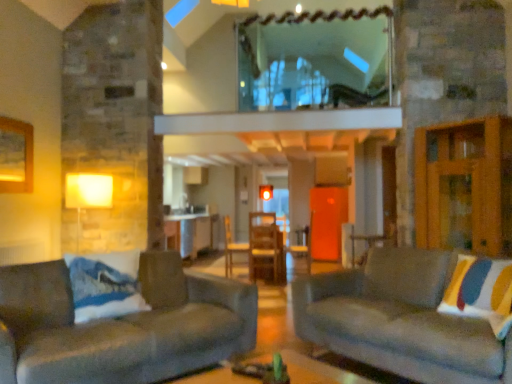
Question: Does velvet gray couch at left, acting as the 2th studio couch starting from the right, turn towards velvet gray couch at right, the 1th studio couch viewed from the right?

Choices:
 (A) no
 (B) yes

Answer: (A)

Question: Is velvet gray couch at right, the 1th studio couch viewed from the right, a part of velvet gray couch at left, positioned as the first studio couch in left-to-right order?

Choices:
 (A) yes
 (B) no

Answer: (B)

Question: Considering the relative positions of velvet gray couch at left, acting as the 2th studio couch starting from the right, and velvet gray couch at right, the 1th studio couch viewed from the right, in the image provided, is velvet gray couch at left, acting as the 2th studio couch starting from the right, to the left of velvet gray couch at right, the 1th studio couch viewed from the right, from the viewer's perspective?

Choices:
 (A) no
 (B) yes

Answer: (B)

Question: Can you confirm if velvet gray couch at left, positioned as the first studio couch in left-to-right order, is taller than velvet gray couch at right, the 1th studio couch viewed from the right?

Choices:
 (A) no
 (B) yes

Answer: (A)

Question: Is velvet gray couch at left, acting as the 2th studio couch starting from the right, completely or partially outside of velvet gray couch at right, the 1th studio couch viewed from the right?

Choices:
 (A) yes
 (B) no

Answer: (A)

Question: Is point (224, 354) positioned closer to the camera than point (74, 192)?

Choices:
 (A) closer
 (B) farther

Answer: (A)

Question: Visually, is velvet gray couch at left, positioned as the first studio couch in left-to-right order, positioned to the left or to the right of matte yellow lampshade at left?

Choices:
 (A) right
 (B) left

Answer: (A)

Question: Is velvet gray couch at left, acting as the 2th studio couch starting from the right, taller or shorter than matte yellow lampshade at left?

Choices:
 (A) short
 (B) tall

Answer: (A)

Question: From the image's perspective, is velvet gray couch at left, positioned as the first studio couch in left-to-right order, above or below matte yellow lampshade at left?

Choices:
 (A) above
 (B) below

Answer: (B)

Question: From a real-world perspective, is metallic silver table at center positioned above or below matte yellow lampshade at left?

Choices:
 (A) above
 (B) below

Answer: (B)

Question: Relative to matte yellow lampshade at left, is metallic silver table at center in front or behind?

Choices:
 (A) behind
 (B) front

Answer: (A)

Question: Is metallic silver table at center bigger or smaller than matte yellow lampshade at left?

Choices:
 (A) small
 (B) big

Answer: (B)

Question: Considering the positions of metallic silver table at center and matte yellow lampshade at left in the image, is metallic silver table at center taller or shorter than matte yellow lampshade at left?

Choices:
 (A) tall
 (B) short

Answer: (A)

Question: Is velvet gray couch at right, the 1th studio couch viewed from the right, bigger or smaller than metallic silver table at center?

Choices:
 (A) big
 (B) small

Answer: (A)

Question: Considering their positions, is velvet gray couch at right, the 1th studio couch viewed from the right, located in front of or behind metallic silver table at center?

Choices:
 (A) front
 (B) behind

Answer: (A)